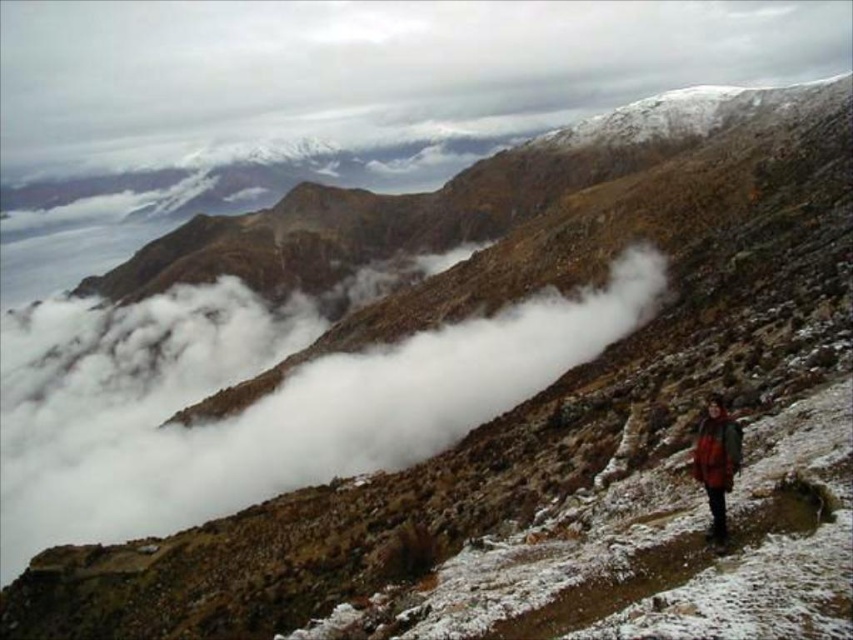
Question: Is white fluffy cloud at upper center closer to camera compared to red plaid jacket at lower right?

Choices:
 (A) yes
 (B) no

Answer: (B)

Question: Among these points, which one is farthest from the camera?

Choices:
 (A) (148, 48)
 (B) (701, 465)

Answer: (A)

Question: Does white fluffy cloud at upper center have a lesser width compared to red plaid jacket at lower right?

Choices:
 (A) yes
 (B) no

Answer: (B)

Question: Is white fluffy cloud at upper center in front of red plaid jacket at lower right?

Choices:
 (A) yes
 (B) no

Answer: (B)